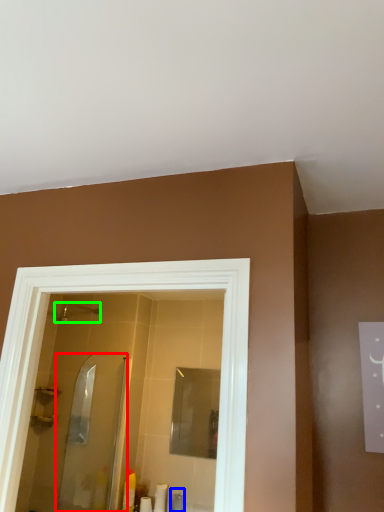
Question: Estimate the real-world distances between objects in this image. Which object is closer to screen door (highlighted by a red box), toiletry (highlighted by a blue box) or shower (highlighted by a green box)?

Choices:
 (A) toiletry
 (B) shower

Answer: (A)